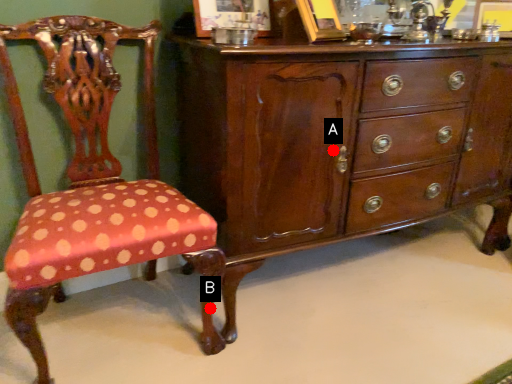
Question: Two points are circled on the image, labeled by A and B beside each circle. Which point is further to the camera?

Choices:
 (A) A is further
 (B) B is further

Answer: (B)